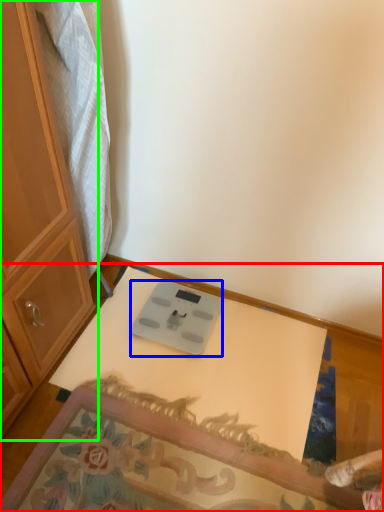
Question: Which object is positioned closest to table (highlighted by a red box)? Select from weight scale (highlighted by a blue box) and cabinetry (highlighted by a green box).

Choices:
 (A) weight scale
 (B) cabinetry

Answer: (A)